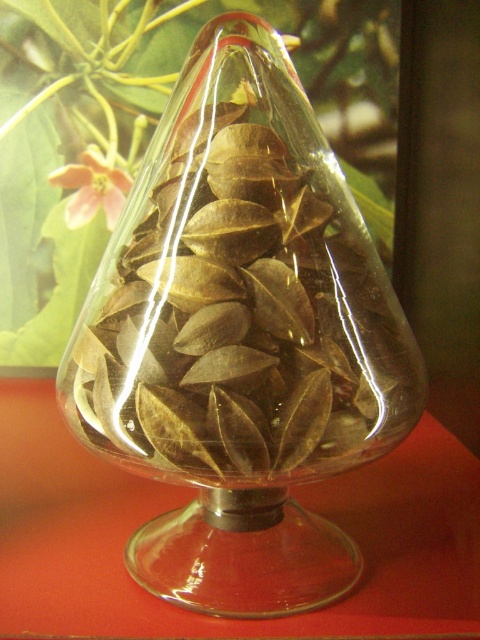
Question: Where is transparent glass vase at center located in relation to pink matte flower at upper left in the image?

Choices:
 (A) above
 (B) below

Answer: (B)

Question: Does transparent glass vase at center appear on the right side of pink matte flower at upper left?

Choices:
 (A) no
 (B) yes

Answer: (B)

Question: Can you confirm if transparent glass vase at center is wider than pink matte flower at upper left?

Choices:
 (A) no
 (B) yes

Answer: (B)

Question: Which object is closer to the camera taking this photo?

Choices:
 (A) pink matte flower at upper left
 (B) transparent glass vase at center

Answer: (B)

Question: Among these objects, which one is farthest from the camera?

Choices:
 (A) transparent glass vase at center
 (B) pink matte flower at upper left

Answer: (B)